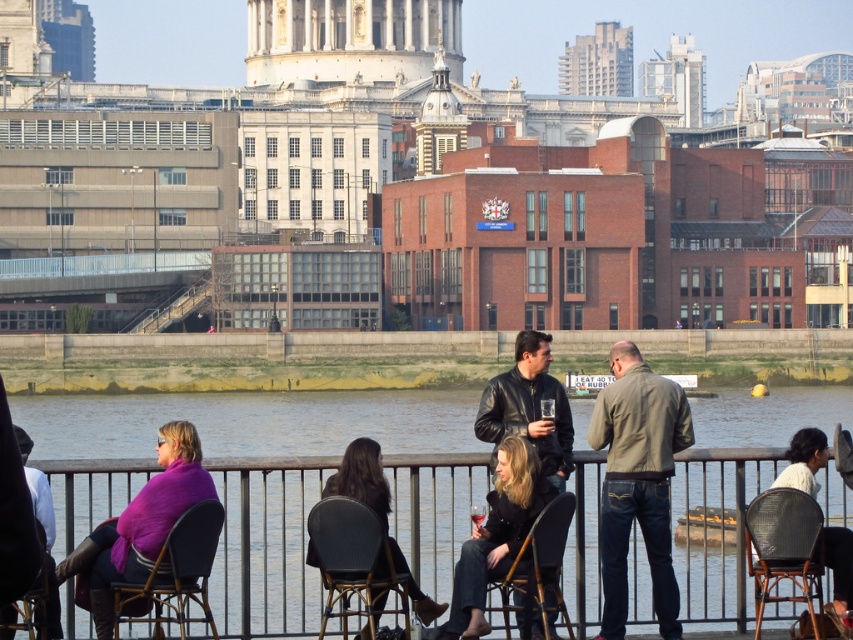
You are standing at the point marked by the coordinates point (531,406) and want to move towards the river. Is there a clear path between you and the river? Please consider the presence of the railing and any people in your way.

The leather jacket at center is represented by point (531,406), so there is no obstruction between you and the river as the railing is present but the jacket is at the center, implying an open space towards the river.

You are standing at the riverside and want to take a photo that includes both point (633, 499) and point (822, 632). Which point should you focus on first to ensure both are in focus?

You should focus on point (633, 499) first because it is closer to the camera than point (822, 632), ensuring both points are within the depth of field.

You are standing at the point marked as point (534, 337) and want to take a photo of the entire riverside scene. The camera you have can capture a maximum distance of 150 feet. Will you be able to capture the entire scene in one shot?

The point marked as point (534, 337) and the camera are 170.14 feet apart from each other. Since the camera can only capture up to 150 feet, you will not be able to capture the entire scene in one shot.